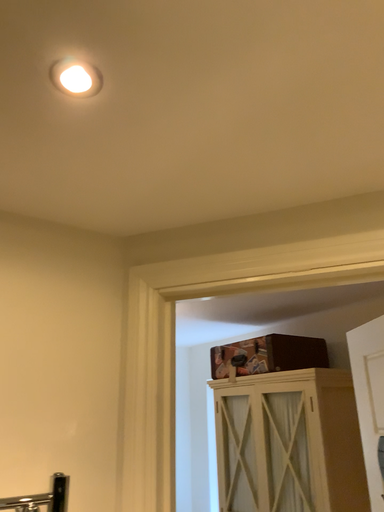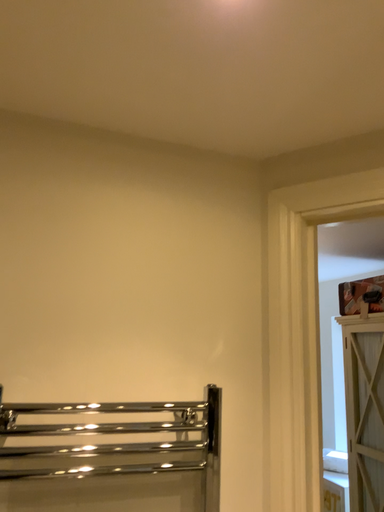
Question: Which way did the camera rotate in the video?

Choices:
 (A) rotated right
 (B) rotated left

Answer: (B)